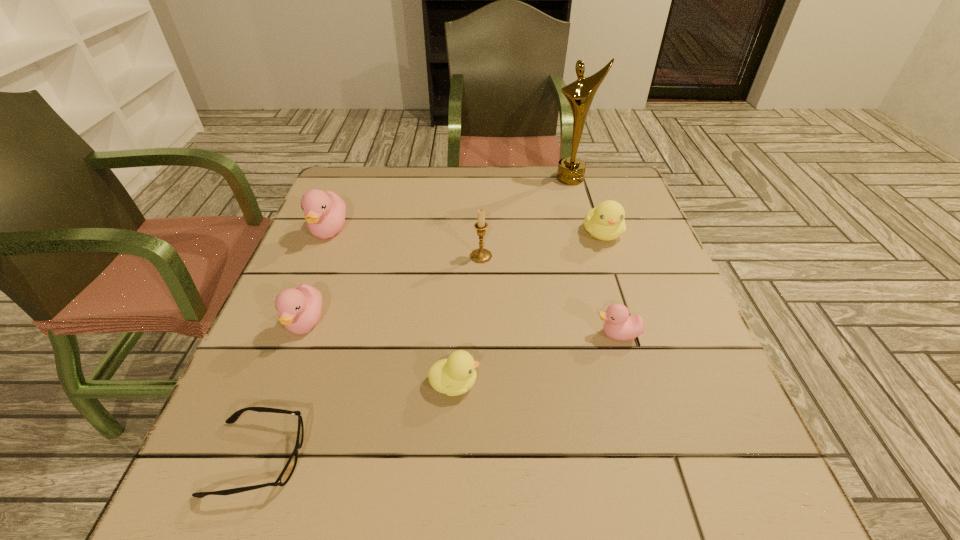
Locate an element on the screen. The width and height of the screenshot is (960, 540). the rightmost pink duckling is located at coordinates (619, 325).

Image resolution: width=960 pixels, height=540 pixels. What are the coordinates of `the shortest object` in the screenshot? It's located at (285, 475).

I want to click on spectacles, so click(x=285, y=475).

Identify the location of free space located 0.210m on the front-facing side of the award. (586, 230).

Identify the location of vacant point located on the back of the candle holder. The width and height of the screenshot is (960, 540). (481, 188).

Where is `vacant space located 0.090m on the front-facing side of the biggest pink duckling`? The image size is (960, 540). vacant space located 0.090m on the front-facing side of the biggest pink duckling is located at coordinates (311, 275).

At what (x,y) coordinates should I click in order to perform the action: click on vacant region located at the beak of the right yellow duckling. Please return your answer as a coordinate pair (x, y). The height and width of the screenshot is (540, 960). Looking at the image, I should click on tap(617, 277).

This screenshot has width=960, height=540. Find the location of `free space located 0.290m on the front-facing side of the second smallest pink duckling`. free space located 0.290m on the front-facing side of the second smallest pink duckling is located at coordinates (236, 507).

I want to click on free spot located 0.190m at the beak of the nearer yellow duckling, so click(586, 383).

This screenshot has height=540, width=960. Identify the location of vacant area situated on the front-facing side of the rightmost pink duckling. (564, 334).